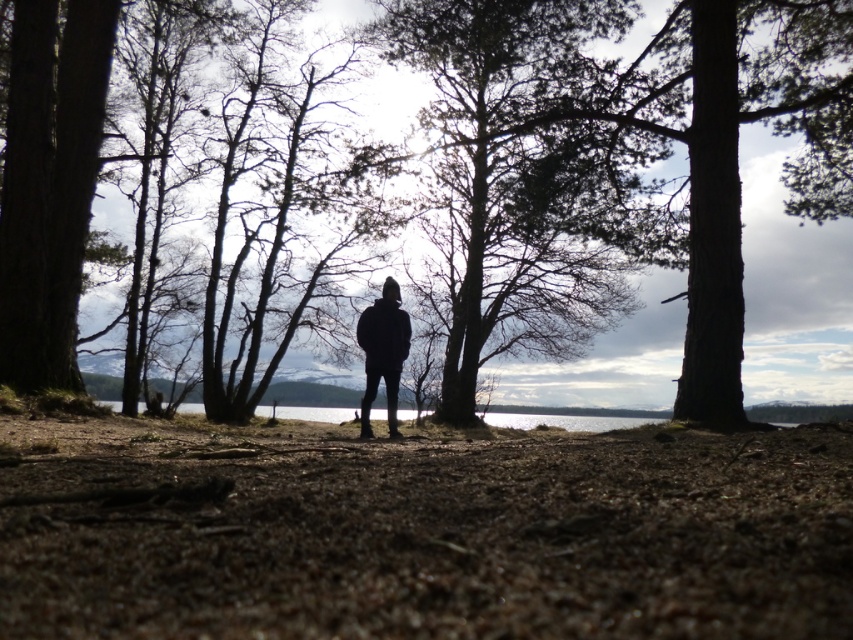
Does point (718, 384) lie behind point (558, 52)?

No.

Measure the distance between brown textured tree at center and camera.

brown textured tree at center is 42.12 feet away from camera.

Between point (843, 74) and point (468, 8), which one is positioned behind?

The point (843, 74) is behind.

Where is `brown textured tree at center`? The image size is (853, 640). brown textured tree at center is located at coordinates (625, 148).

Does dark green textured tree at center have a smaller size compared to black matte jacket at center?

Incorrect, dark green textured tree at center is not smaller in size than black matte jacket at center.

Is point (611, 282) farther from camera compared to point (381, 324)?

Yes.

Locate an element on the screen. The width and height of the screenshot is (853, 640). dark green textured tree at center is located at coordinates (519, 173).

Find the location of `dark green textured tree at center`. dark green textured tree at center is located at coordinates (519, 173).

Is point (50, 300) positioned after point (396, 320)?

Yes, it is.

Between point (720, 33) and point (378, 349), which one is positioned in front?

Point (378, 349) is in front.

Between point (653, 248) and point (387, 300), which one is positioned in front?

Point (387, 300) is in front.

Locate an element on the screen. brown textured tree at center is located at coordinates (625, 148).